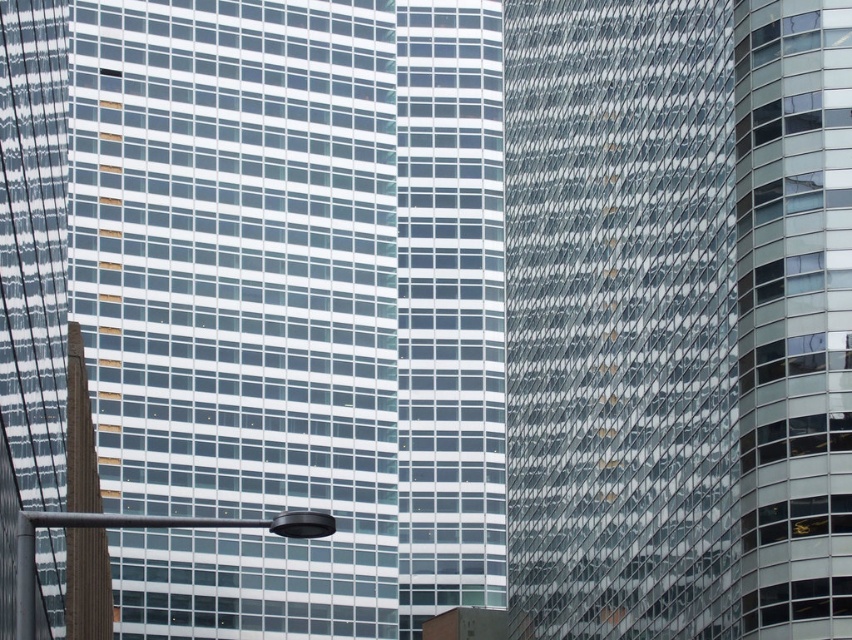
Question: Is transparent glass building at center further to camera compared to glassy reflective skyscraper at center?

Choices:
 (A) yes
 (B) no

Answer: (B)

Question: Does transparent glass building at center have a smaller size compared to glassy reflective skyscraper at center?

Choices:
 (A) yes
 (B) no

Answer: (B)

Question: Is transparent glass building at center below glassy reflective skyscraper at center?

Choices:
 (A) yes
 (B) no

Answer: (A)

Question: Which of the following is the closest to the observer?

Choices:
 (A) (839, 536)
 (B) (335, 496)

Answer: (A)